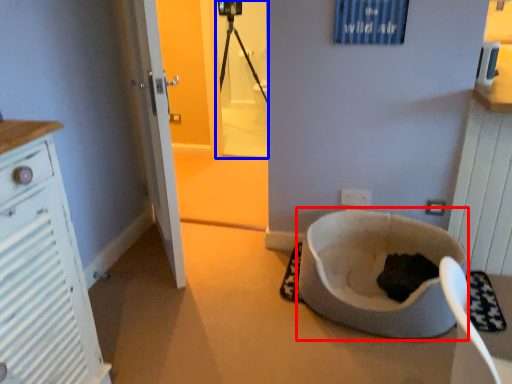
Question: Among these objects, which one is nearest to the camera, toilet bowl (highlighted by a red box) or screen door (highlighted by a blue box)?

Choices:
 (A) toilet bowl
 (B) screen door

Answer: (A)